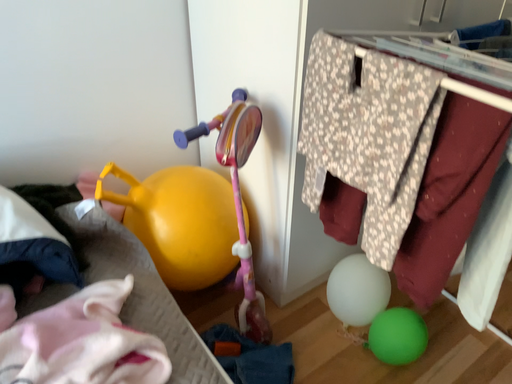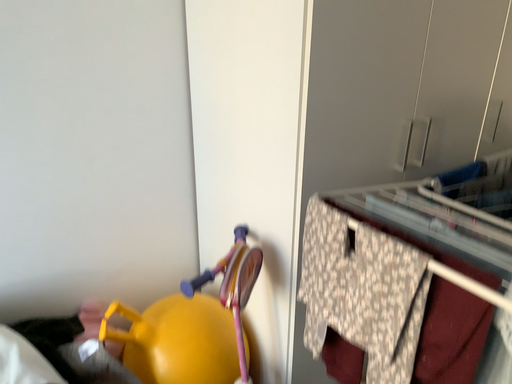
Question: How did the camera likely rotate when shooting the video?

Choices:
 (A) rotated downward
 (B) rotated upward

Answer: (B)